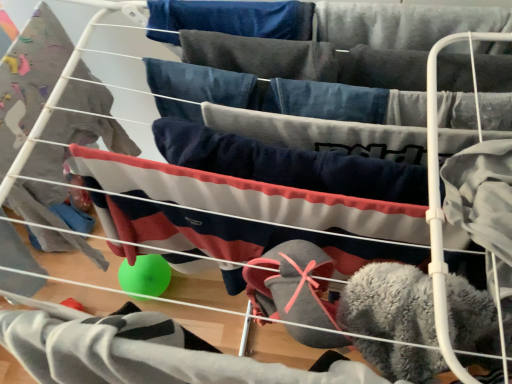
Question: From a real-world perspective, is fuzzy gray socks at lower center, the second clothing in the top-to-bottom sequence, physically below navy blue fleece pants at center, which is counted as the first clothing, starting from the top?

Choices:
 (A) no
 (B) yes

Answer: (B)

Question: Is fuzzy gray socks at lower center, acting as the first clothing starting from the bottom, surrounding navy blue fleece pants at center, which is counted as the first clothing, starting from the top?

Choices:
 (A) yes
 (B) no

Answer: (B)

Question: From a real-world perspective, does fuzzy gray socks at lower center, the second clothing in the top-to-bottom sequence, stand above navy blue fleece pants at center, which is counted as the first clothing, starting from the top?

Choices:
 (A) yes
 (B) no

Answer: (B)

Question: Does fuzzy gray socks at lower center, the second clothing in the top-to-bottom sequence, have a greater height compared to navy blue fleece pants at center, which is the 2th clothing from bottom to top?

Choices:
 (A) no
 (B) yes

Answer: (B)

Question: Considering the relative sizes of fuzzy gray socks at lower center, acting as the first clothing starting from the bottom, and navy blue fleece pants at center, which is counted as the first clothing, starting from the top, in the image provided, is fuzzy gray socks at lower center, acting as the first clothing starting from the bottom, wider than navy blue fleece pants at center, which is counted as the first clothing, starting from the top,?

Choices:
 (A) yes
 (B) no

Answer: (A)

Question: Is fuzzy gray socks at lower center, acting as the first clothing starting from the bottom, touching navy blue fleece pants at center, which is the 2th clothing from bottom to top?

Choices:
 (A) no
 (B) yes

Answer: (A)

Question: Can you confirm if navy blue fleece pants at center, which is counted as the first clothing, starting from the top, is shorter than fuzzy gray socks at lower center, acting as the first clothing starting from the bottom?

Choices:
 (A) yes
 (B) no

Answer: (A)

Question: From a real-world perspective, is navy blue fleece pants at center, which is the 2th clothing from bottom to top, located beneath fuzzy gray socks at lower center, acting as the first clothing starting from the bottom?

Choices:
 (A) no
 (B) yes

Answer: (A)

Question: Is navy blue fleece pants at center, which is the 2th clothing from bottom to top, at the right side of fuzzy gray socks at lower center, the second clothing in the top-to-bottom sequence?

Choices:
 (A) no
 (B) yes

Answer: (B)

Question: Does navy blue fleece pants at center, which is counted as the first clothing, starting from the top, have a smaller size compared to fuzzy gray socks at lower center, acting as the first clothing starting from the bottom?

Choices:
 (A) no
 (B) yes

Answer: (B)

Question: Is navy blue fleece pants at center, which is counted as the first clothing, starting from the top, facing towards fuzzy gray socks at lower center, acting as the first clothing starting from the bottom?

Choices:
 (A) yes
 (B) no

Answer: (A)

Question: Does navy blue fleece pants at center, which is the 2th clothing from bottom to top, have a larger size compared to fuzzy gray socks at lower center, the second clothing in the top-to-bottom sequence?

Choices:
 (A) yes
 (B) no

Answer: (B)

Question: From the image's perspective, is fuzzy gray socks at lower center, the second clothing in the top-to-bottom sequence, above or below navy blue fleece pants at center, which is counted as the first clothing, starting from the top?

Choices:
 (A) below
 (B) above

Answer: (A)